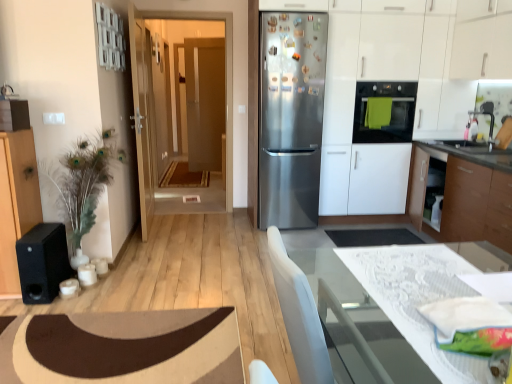
Locate an element on the screen. The width and height of the screenshot is (512, 384). free space above white lace table at lower right (from a real-world perspective) is located at coordinates (435, 291).